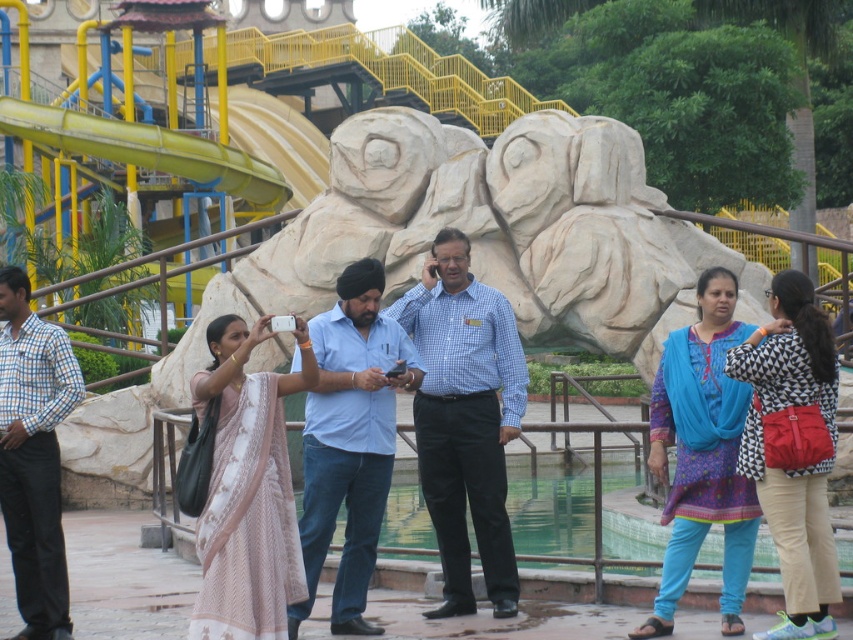
Question: Can you confirm if blue cotton shirt at center is wider than yellow rubber slide at upper left?

Choices:
 (A) yes
 (B) no

Answer: (B)

Question: Which is farther from the blue checkered shirt at left?

Choices:
 (A) yellow rubber slide at upper left
 (B) blue cotton shirt at center
 (C) blue checkered shirt at center

Answer: (A)

Question: Does blue checkered shirt at center have a lesser width compared to blue cotton shirt at center?

Choices:
 (A) no
 (B) yes

Answer: (A)

Question: Which object is positioned farthest from the blue checkered shirt at left?

Choices:
 (A) yellow rubber slide at upper left
 (B) blue checkered shirt at center
 (C) blue cotton shirt at center

Answer: (A)

Question: Which object is positioned closest to the blue checkered shirt at left?

Choices:
 (A) blue checkered shirt at center
 (B) blue cotton shirt at center
 (C) yellow rubber slide at upper left

Answer: (B)

Question: Is blue checkered shirt at center positioned before blue cotton shirt at center?

Choices:
 (A) yes
 (B) no

Answer: (B)